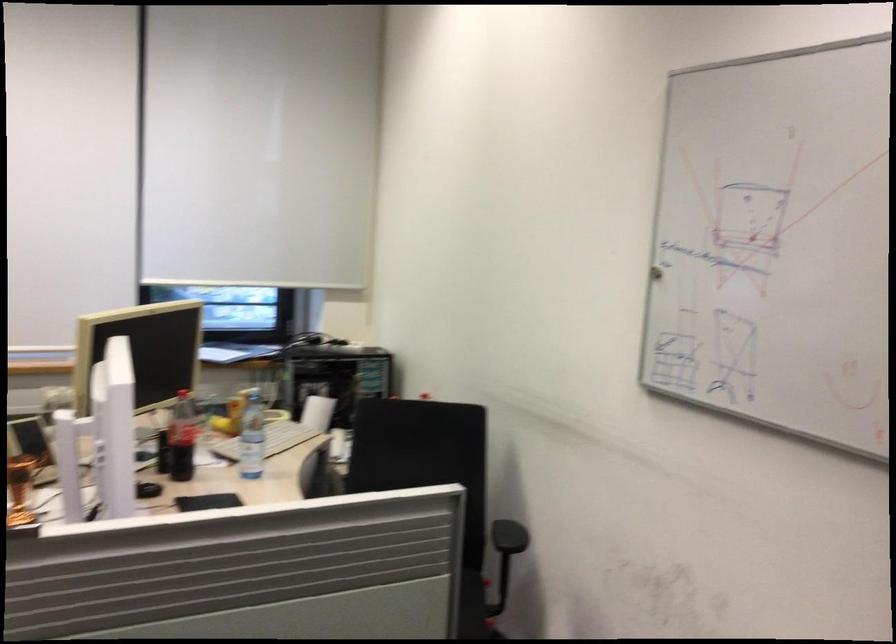
What do you see at coordinates (182, 438) in the screenshot? I see `the coca-cola bottle` at bounding box center [182, 438].